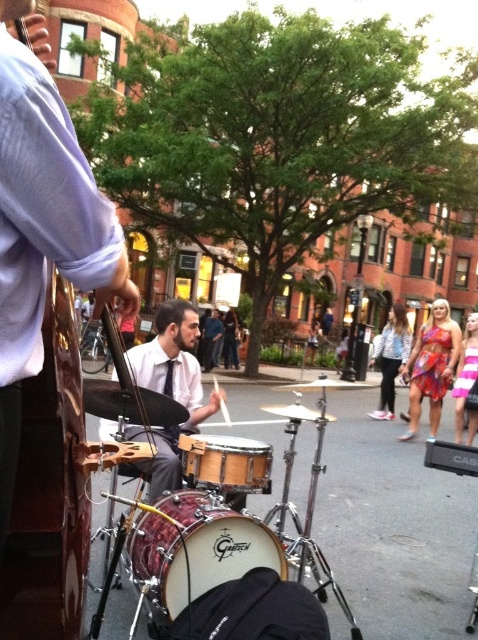
You are standing at the point with coordinates point (x=457, y=365) and want to walk to the point with coordinates point (x=245, y=544). Is the point you want to reach in front of or behind you?

The point with coordinates point (x=245, y=544) is in front of the point with coordinates point (x=457, y=365), so the destination is in front of you.

You are a photographer standing in front of the stage. You want to capture a photo that includes both the matte white shirt at center and the wooden drum at center. Based on their widths, which object should you position closer to the center of the frame to ensure both fit in the shot?

Since the matte white shirt at center is wider than the wooden drum at center, you should position the matte white shirt at center closer to the center of the frame to ensure both fit in the shot.

You are a photographer trying to capture the drummer in the middle ground. You notice the matte white shirt at center and the wooden drum at center. Which object is closer to the camera?

The matte white shirt at center is positioned over the wooden drum at center, so it is closer to the camera.